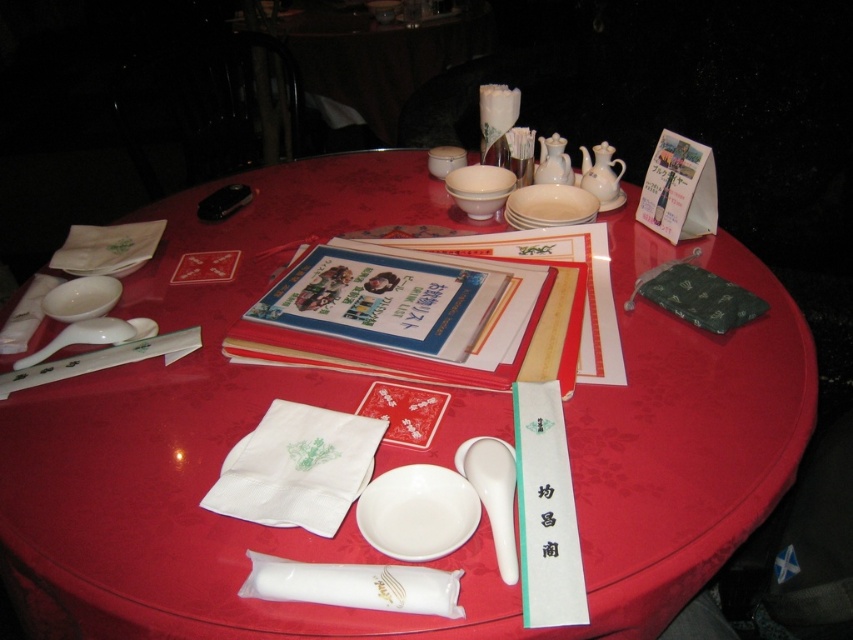
You are a server at a Japanese restaurant and need to place a small appetizer on either the white ceramic plates at center or the white porcelain bowls at center. Which one would be more appropriate based on their sizes?

The white ceramic plates at center are smaller in size compared to the white porcelain bowls at center, so the small appetizer would be more appropriately placed on the white ceramic plates at center.

You are a server in a Japanese restaurant and need to retrieve the white ceramic spoon at center for a customer. However, there is a white ceramic teapot at upper center blocking your access. Can you reach the spoon without moving the teapot?

The white ceramic spoon at center is positioned under the white ceramic teapot at upper center, so you cannot reach the spoon without moving the teapot.

You are a server at a Japanese restaurant and need to place a new menu between the white ceramic plates at center and the white porcelain bowls at center. According to the table setup, which side should you place the menu on?

The white ceramic plates at center are to the right of the white porcelain bowls at center, so you should place the menu to the left of the white ceramic plates at center or to the right of the white porcelain bowls at center to ensure it is between them.